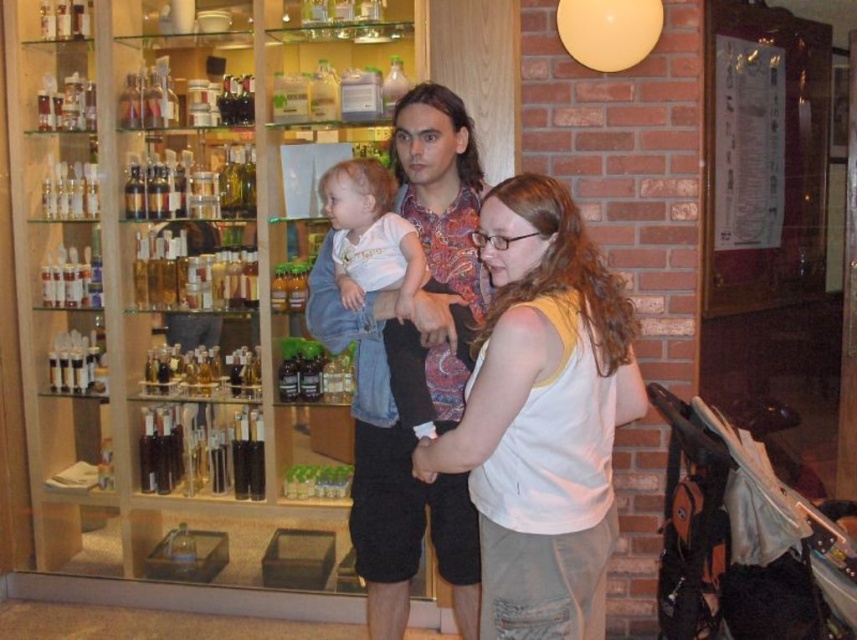
Who is more forward, (480, 172) or (423, 426)?

Point (423, 426) is more forward.

Who is shorter, matte floral shirt at center or white soft shirt at center?

Standing shorter between the two is white soft shirt at center.

Is point (403, 132) in front of point (399, 236)?

That is False.

I want to click on matte floral shirt at center, so click(412, 369).

Identify the location of white cotton tank top at center. The height and width of the screenshot is (640, 857). (543, 417).

Which is above, white cotton tank top at center or matte floral shirt at center?

Positioned higher is matte floral shirt at center.

Does white cotton tank top at center appear on the left side of matte floral shirt at center?

Incorrect, white cotton tank top at center is not on the left side of matte floral shirt at center.

Who is more distant from viewer, (500, 458) or (382, 376)?

Positioned behind is point (382, 376).

Find the location of a particular element. The height and width of the screenshot is (640, 857). white cotton tank top at center is located at coordinates [543, 417].